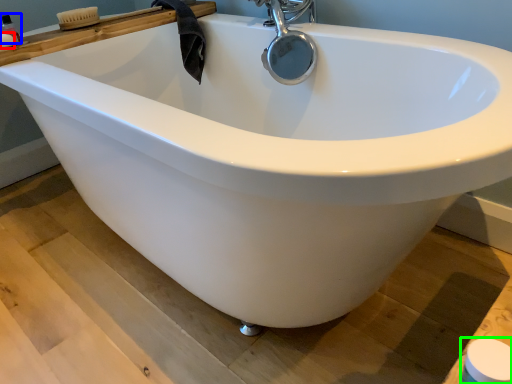
Question: Which is nearer to the soap (highlighted by a red box)? toiletry (highlighted by a blue box) or toilet paper (highlighted by a green box).

Choices:
 (A) toiletry
 (B) toilet paper

Answer: (A)